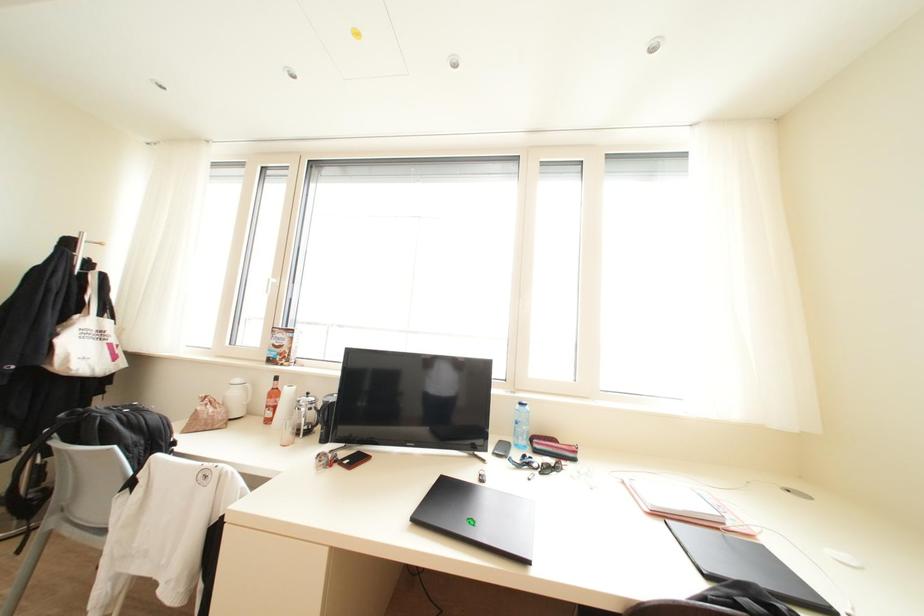
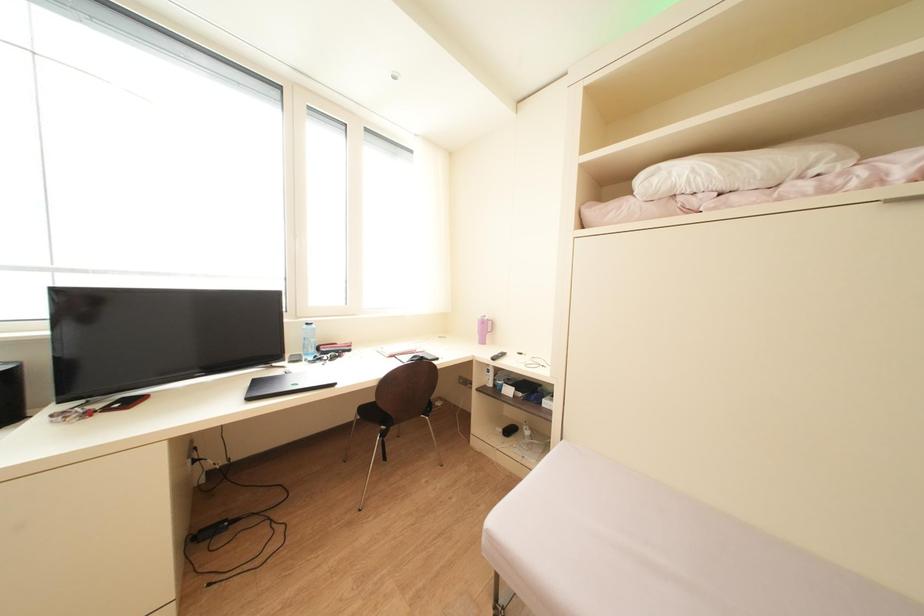
Question: The camera is either moving clockwise (left) or counter-clockwise (right) around the object. The first image is from the beginning of the video and the second image is from the end. Is the camera moving left or right when shooting the video?

Choices:
 (A) Left
 (B) Right

Answer: (A)